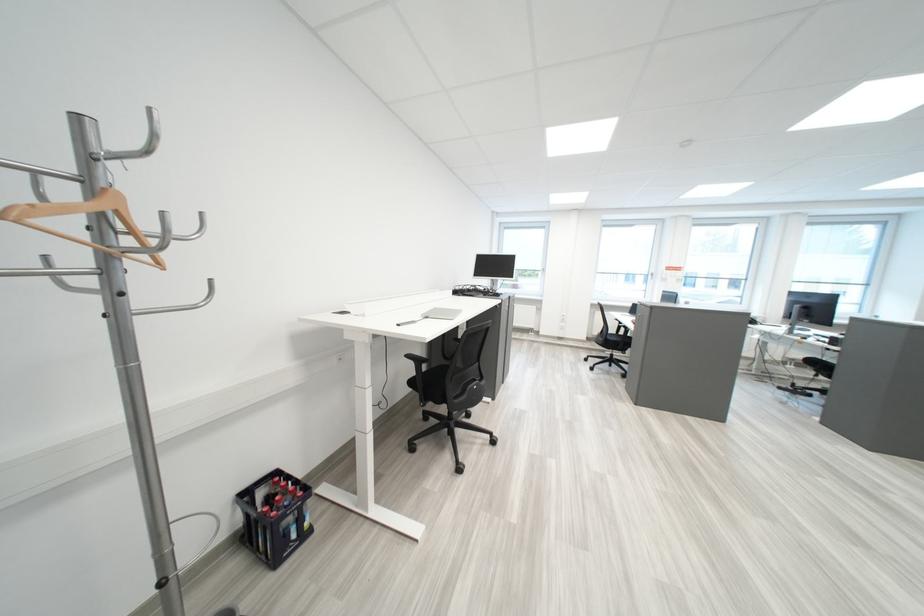
Find where to lift the silver laptop. Please return your answer as a coordinate pair (x, y).

(441, 313)